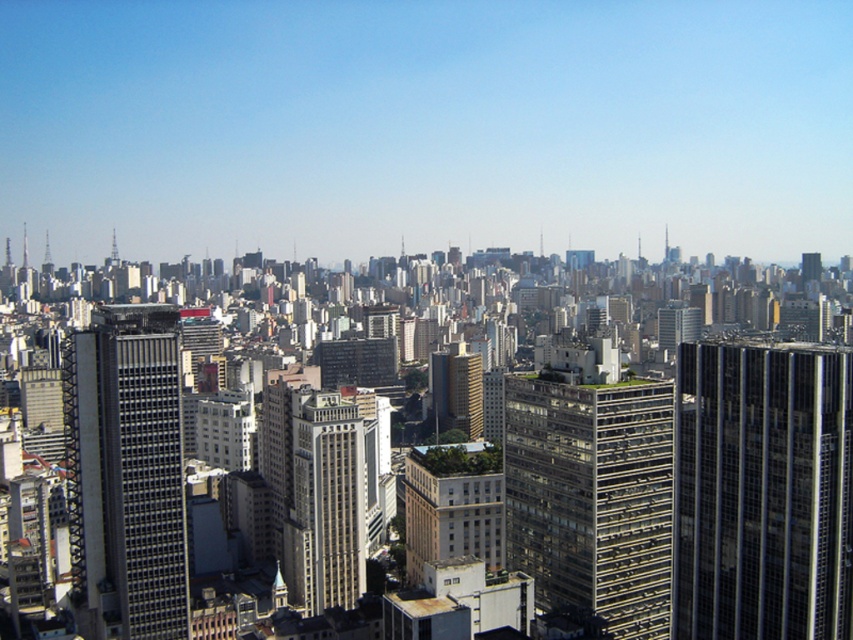
How much distance is there between glassy concrete skyscraper at center and beige stone building at center?

97.33 meters

This screenshot has height=640, width=853. Describe the element at coordinates (592, 497) in the screenshot. I see `glassy concrete skyscraper at center` at that location.

The width and height of the screenshot is (853, 640). What are the coordinates of `glassy concrete skyscraper at center` in the screenshot? It's located at (592, 497).

Can you confirm if matte glass skyscraper at center-left is shorter than white concrete building at center?

Incorrect, matte glass skyscraper at center-left's height does not fall short of white concrete building at center's.

Which is below, matte glass skyscraper at center-left or white concrete building at center?

white concrete building at center is lower down.

You are a GUI agent. You are given a task and a screenshot of the screen. Output one action in this format:
    pyautogui.click(x=<x>, y=<y>)
    Task: Click on the matte glass skyscraper at center-left
    The image size is (853, 640).
    Given the screenshot: What is the action you would take?
    pyautogui.click(x=126, y=470)

Where is `matte glass skyscraper at center-left`? The image size is (853, 640). matte glass skyscraper at center-left is located at coordinates (126, 470).

Between glassy concrete skyscraper at center and matte glass skyscraper at center-left, which one has less height?

With less height is glassy concrete skyscraper at center.

Does glassy concrete skyscraper at center have a smaller size compared to matte glass skyscraper at center-left?

Yes, glassy concrete skyscraper at center is smaller than matte glass skyscraper at center-left.

Measure the distance between glassy concrete skyscraper at center and camera.

They are 397.41 meters apart.

Where is `glassy concrete skyscraper at center`? glassy concrete skyscraper at center is located at coordinates (592, 497).